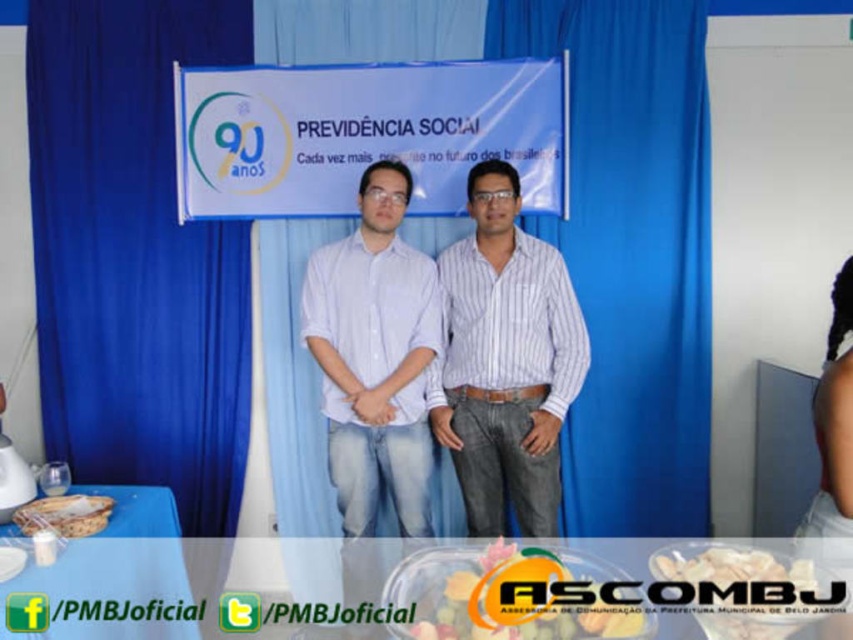
Question: Which of the following is the closest to the observer?

Choices:
 (A) blue plastic table at lower left
 (B) white crumbly food at center
 (C) translucent plastic container at center

Answer: (C)

Question: Does blue plastic table at lower left lie in front of matte brown bread at lower left?

Choices:
 (A) no
 (B) yes

Answer: (B)

Question: Which of the following is the closest to the observer?

Choices:
 (A) (706, 570)
 (B) (74, 504)

Answer: (A)

Question: Where is white striped shirt at center located in relation to matte brown bread at lower left in the image?

Choices:
 (A) right
 (B) left

Answer: (A)

Question: Estimate the real-world distances between objects in this image. Which object is closer to the matte brown bread at lower left?

Choices:
 (A) white crumbly food at center
 (B) blue plastic table at lower left

Answer: (B)

Question: In this image, where is white striped shirt at center located relative to matte brown bread at lower left?

Choices:
 (A) above
 (B) below

Answer: (A)